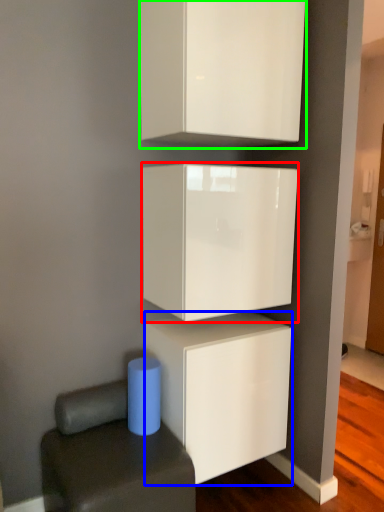
Question: Estimate the real-world distances between objects in this image. Which object is farther from cabinetry (highlighted by a red box), cabinetry (highlighted by a blue box) or cabinetry (highlighted by a green box)?

Choices:
 (A) cabinetry
 (B) cabinetry

Answer: (B)